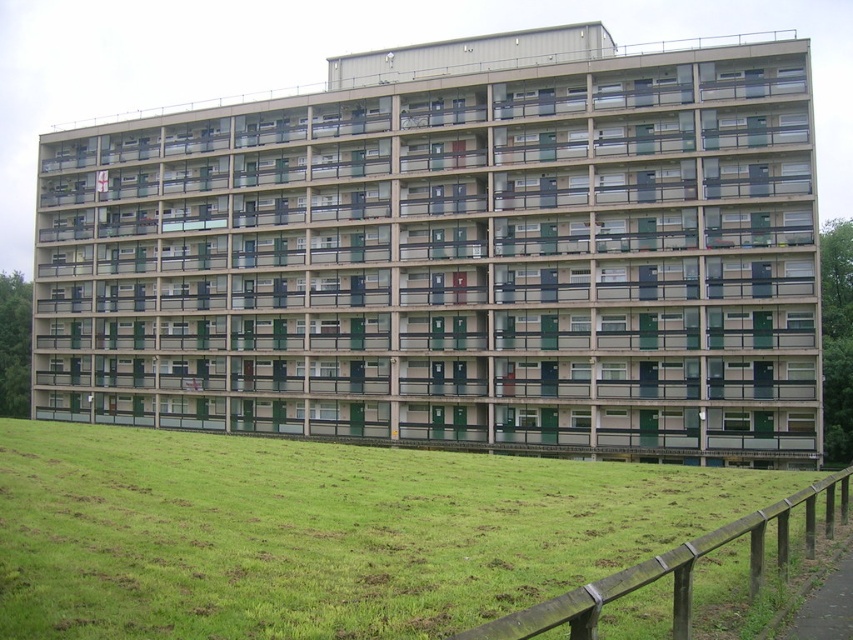
Question: Considering the relative positions of green grass at lower center and wooden at lower right in the image provided, where is green grass at lower center located with respect to wooden at lower right?

Choices:
 (A) left
 (B) right

Answer: (A)

Question: Which point is closer to the camera?

Choices:
 (A) (583, 636)
 (B) (532, 573)

Answer: (A)

Question: Among these points, which one is nearest to the camera?

Choices:
 (A) coord(405,627)
 (B) coord(782,524)

Answer: (A)

Question: Can you confirm if green grass at lower center is smaller than wooden at lower right?

Choices:
 (A) yes
 (B) no

Answer: (B)

Question: Observing the image, what is the correct spatial positioning of green grass at lower center in reference to wooden at lower right?

Choices:
 (A) right
 (B) left

Answer: (B)